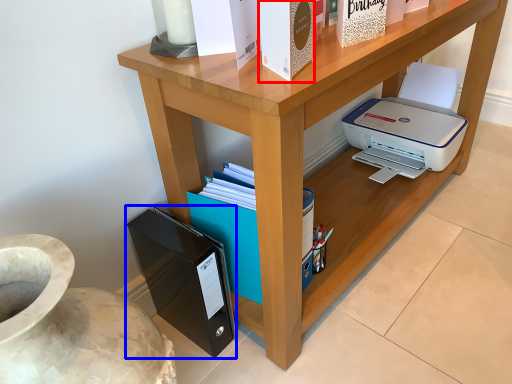
Question: Among these objects, which one is farthest to the camera, paperback book (highlighted by a red box) or paperback book (highlighted by a blue box)?

Choices:
 (A) paperback book
 (B) paperback book

Answer: (B)